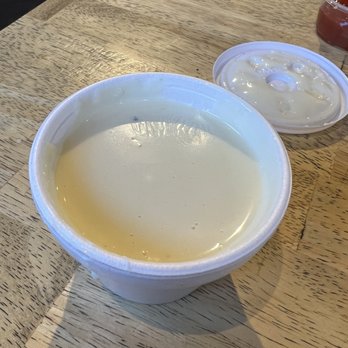
At what (x,y) coordinates should I click in order to perform the action: click on shadow inside cup. Please return your answer as a coordinate pair (x, y). The width and height of the screenshot is (348, 348). Looking at the image, I should click on (128, 108).